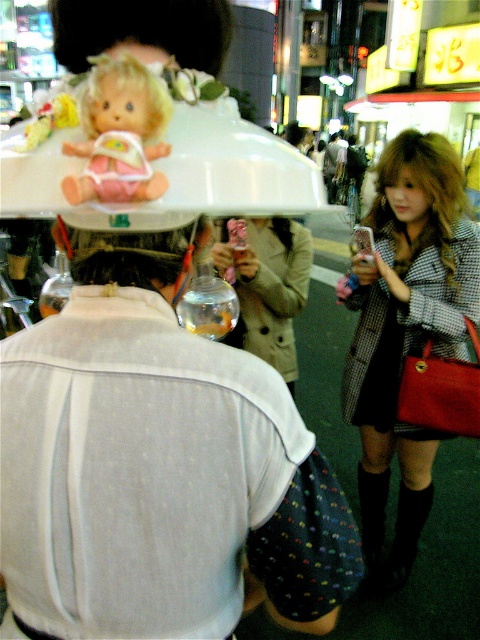
Between point (159, 176) and point (128, 246), which one is positioned behind?

The point (128, 246) is behind.

Is matte plastic doll at upper left bigger than brown leather hair at center?

Yes.

Identify the location of matte plastic doll at upper left. (120, 132).

Between point (122, 148) and point (106, 118), which one is positioned in front?

Point (122, 148) is more forward.

Does matte plastic doll at upper left appear on the left side of blonde hair doll at upper center?

Incorrect, matte plastic doll at upper left is not on the left side of blonde hair doll at upper center.

This screenshot has height=640, width=480. Identify the location of matte plastic doll at upper left. (120, 132).

Can you confirm if shiny blonde hair at center is thinner than blonde hair doll at upper center?

Incorrect, shiny blonde hair at center's width is not less than blonde hair doll at upper center's.

This screenshot has height=640, width=480. What do you see at coordinates (421, 179) in the screenshot?
I see `shiny blonde hair at center` at bounding box center [421, 179].

Is point (397, 224) farther from camera compared to point (155, 113)?

That is True.

Where is `shiny blonde hair at center`? The width and height of the screenshot is (480, 640). shiny blonde hair at center is located at coordinates (421, 179).